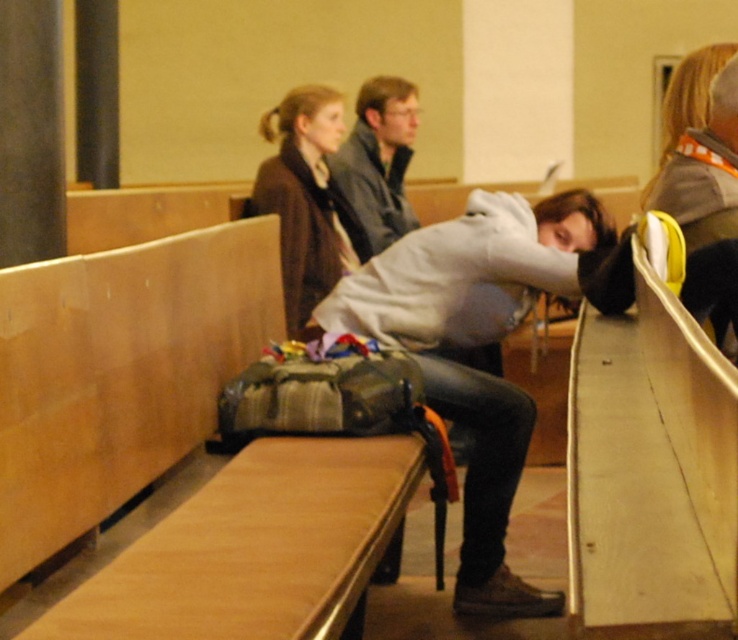
You are standing in the lecture hall and want to determine which of the two points, point (272,163) or point (396,116), is nearer to you. Based on the scene, which point is closer?

Point (272,163) is closer to the camera than point (396,116), so it is the nearer one.

You are standing at the entrance of the lecture hall and see the white matte hoodie at center. If you walk straight towards it, will you reach it before the green backpack on the bench next to it?

The white matte hoodie at center is located at point (472, 346), so walking straight towards it would reach it before the green backpack on the bench next to it since it is closer along the path.

You are standing at the front of the lecture hall and want to determine which of the two points, point (58, 524) or point (376, 109), is closer to you. Based on the image, which point is nearer?

Point (58, 524) is closer to the viewer than point (376, 109).